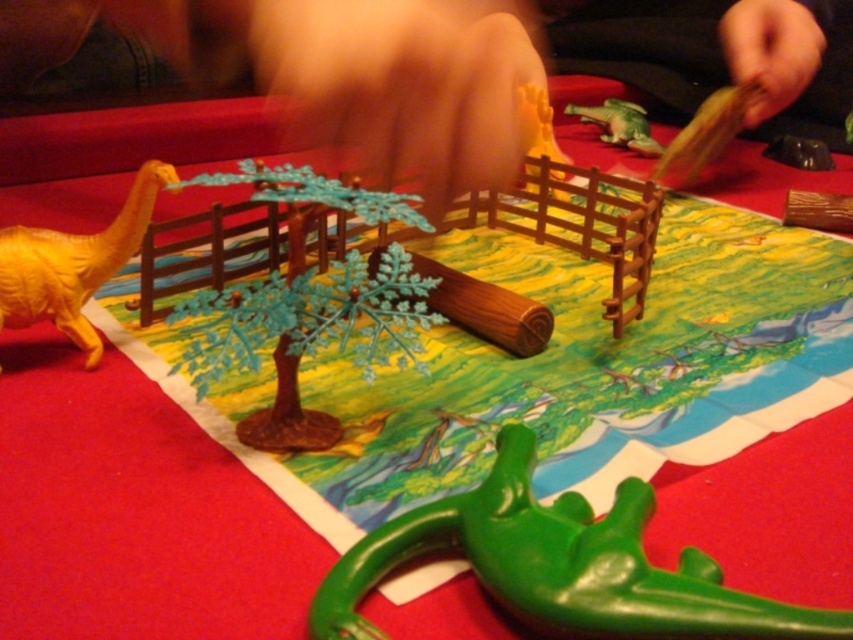
You are a child trying to place a new toy on the table. The yellow matte dinosaur at left is already placed at point (73, 264). Can you tell me where exactly the yellow matte dinosaur at left is located on the table?

The yellow matte dinosaur at left is located at point (73, 264) on the table.

Looking at this image, you are a child trying to place a new toy in the scene. The yellow matte dinosaur at left is below the green plastic crocodile at upper right. If you want to place a new toy between them, where should you put it?

You should place the new toy between the yellow matte dinosaur at left and the green plastic crocodile at upper right, positioning it somewhere in the middle area between their vertical positions since the yellow matte dinosaur at left is located below the green plastic crocodile at upper right.

You are a child playing with the toy dinosaurs on the map. You want to place a new toy dinosaur exactly at the point marked as point (561, 566). What will you find there?

At point (561, 566) lies a green plastic dinosaur at lower center.